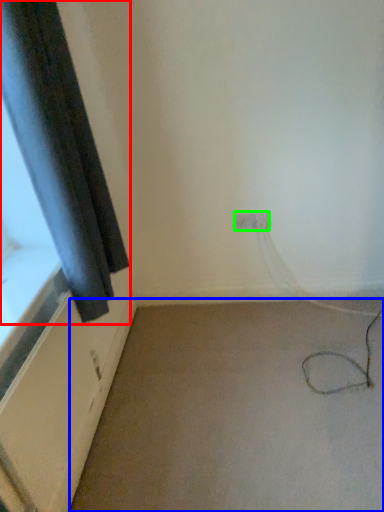
Question: Considering the real-world distances, which object is farthest from curtain (highlighted by a red box)? plain (highlighted by a blue box) or electric outlet (highlighted by a green box)?

Choices:
 (A) plain
 (B) electric outlet

Answer: (B)